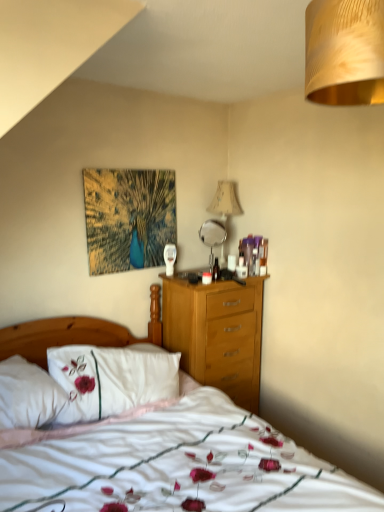
Question: From the image's perspective, is gold textured lampshade at upper right, marked as the first lamp in a front-to-back arrangement, positioned above or below beige fabric lampshade at upper center, which is the second lamp from front to back?

Choices:
 (A) above
 (B) below

Answer: (A)

Question: Looking at their shapes, would you say gold textured lampshade at upper right, the second lamp when ordered from back to front, is wider or thinner than beige fabric lampshade at upper center, the first lamp from the back?

Choices:
 (A) wide
 (B) thin

Answer: (A)

Question: Which object is the farthest from the white embroidered pillow at left?

Choices:
 (A) gold textured lampshade at upper right, the second lamp when ordered from back to front
 (B) metallic silver mirror at center
 (C) white soft bed at center
 (D) beige fabric lampshade at upper center, the first lamp from the back

Answer: (A)

Question: Considering the real-world distances, which object is farthest from the beige fabric lampshade at upper center, the first lamp from the back?

Choices:
 (A) white soft bed at center
 (B) metallic silver mirror at center
 (C) gold textured lampshade at upper right, marked as the first lamp in a front-to-back arrangement
 (D) white embroidered pillow at left

Answer: (C)